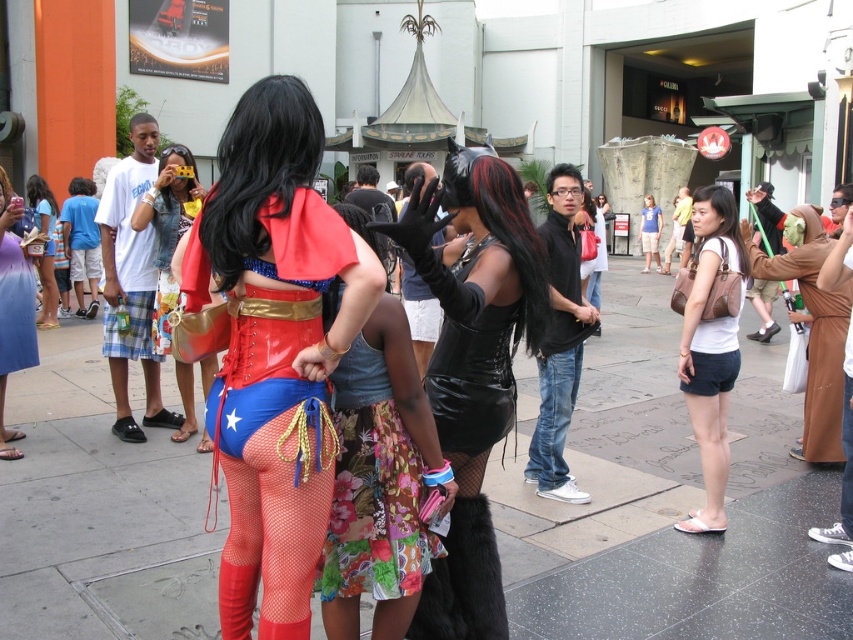
You are a photographer planning to take a group photo of the people in the scene. You need to ensure that the white matte shorts at right and the matte brown purse at left are both visible in the frame. Considering their sizes, which object should you focus on to ensure both are captured clearly?

The white matte shorts at right has a smaller size compared to matte brown purse at left, so focusing on the matte brown purse at left would help ensure both objects are visible as it is larger and easier to frame.